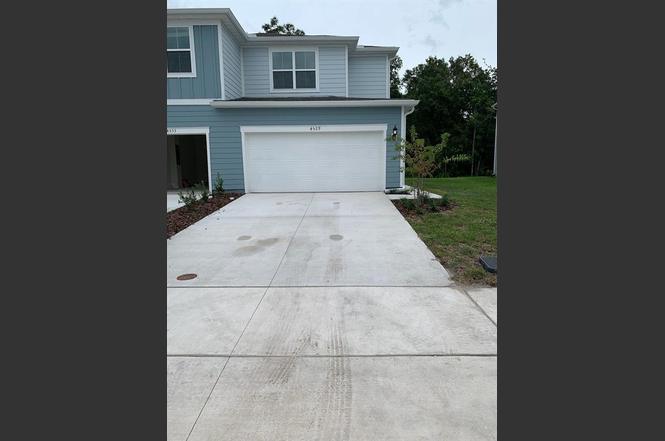
Locate an element on the screen. The height and width of the screenshot is (441, 665). windows is located at coordinates (187, 68), (282, 75).